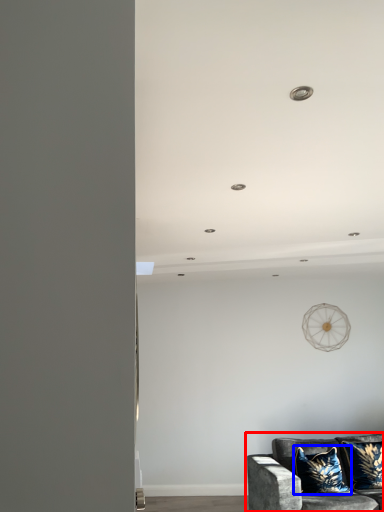
Question: Which object appears closest to the camera in this image, studio couch (highlighted by a red box) or pillow (highlighted by a blue box)?

Choices:
 (A) studio couch
 (B) pillow

Answer: (A)